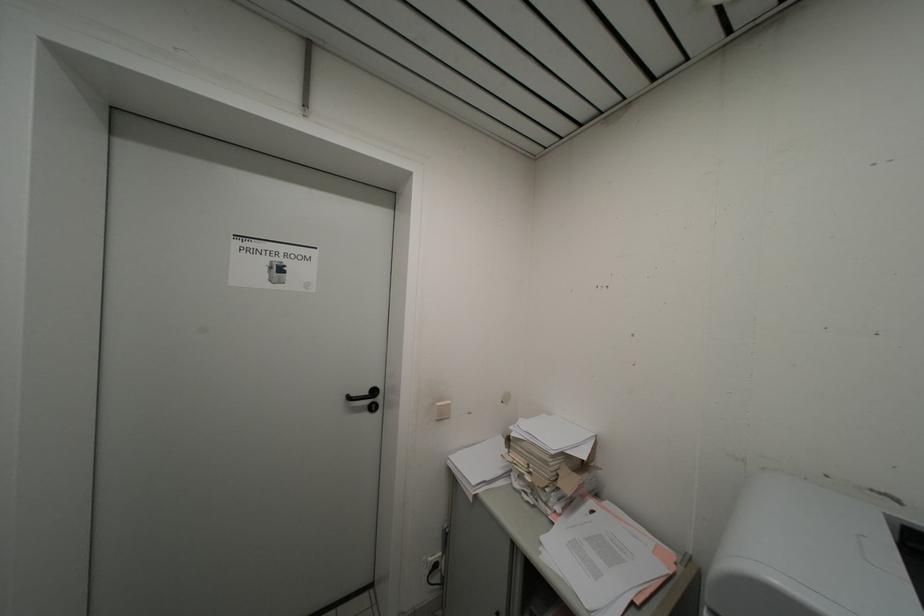
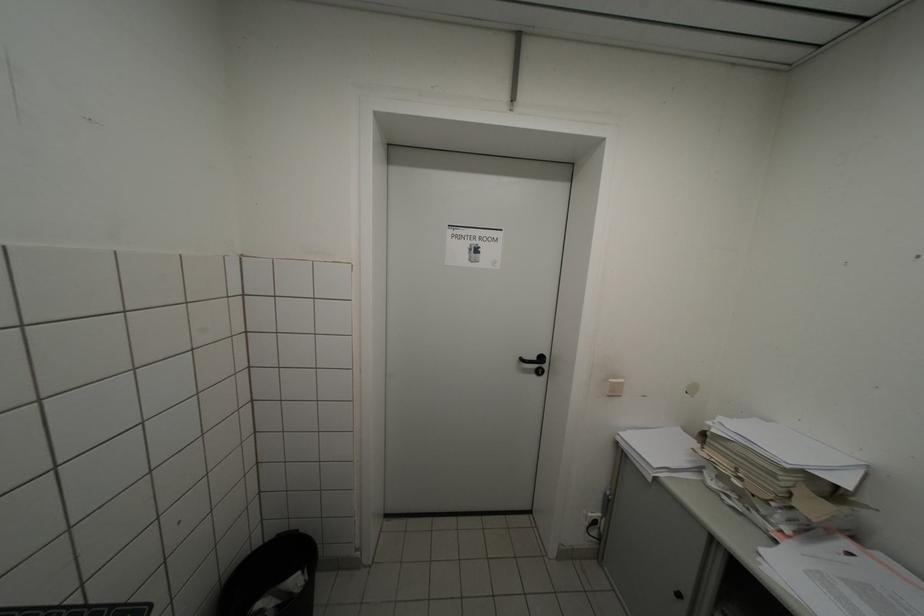
The images are taken continuously from a first-person perspective. In which direction are you moving?

The cameraman walked toward left, backward.